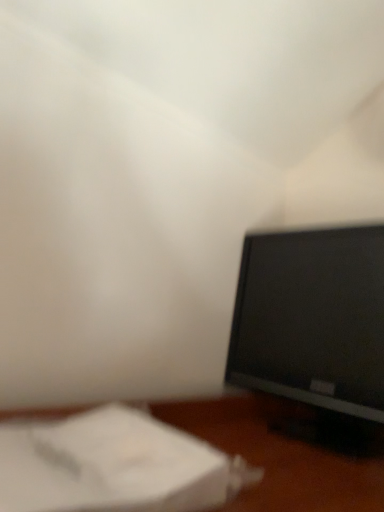
Locate an element on the screen. This screenshot has width=384, height=512. black matte television at right is located at coordinates (315, 331).

Describe the element at coordinates (315, 331) in the screenshot. I see `black matte television at right` at that location.

What is the approximate width of black matte television at right?

It is 15.81 inches.

Identify the location of black matte television at right. (315, 331).